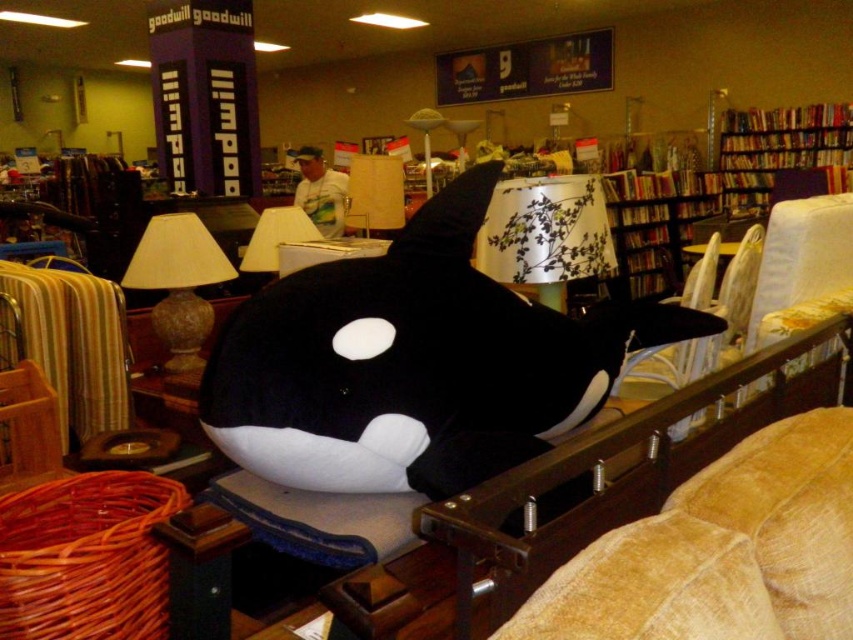
Question: In this image, where is black plush whale at center located relative to wooden bookshelf at upper right?

Choices:
 (A) below
 (B) above

Answer: (A)

Question: Which is farther from the velvet tan couch at lower right?

Choices:
 (A) beige fabric lampshade at center
 (B) white floral fabric lampshade at upper center

Answer: (A)

Question: Is wooden bookshelf at upper right wider than matte brown lampshade at left?

Choices:
 (A) no
 (B) yes

Answer: (B)

Question: Does black plush whale at center have a larger size compared to matte brown lampshade at left?

Choices:
 (A) yes
 (B) no

Answer: (A)

Question: Which of the following is the farthest from the observer?

Choices:
 (A) (374, 220)
 (B) (138, 253)
 (C) (512, 406)
 (D) (613, 262)

Answer: (A)

Question: Which object is farther from the camera taking this photo?

Choices:
 (A) velvet tan couch at lower right
 (B) matte brown lampshade at left
 (C) white paper lampshade at center

Answer: (B)